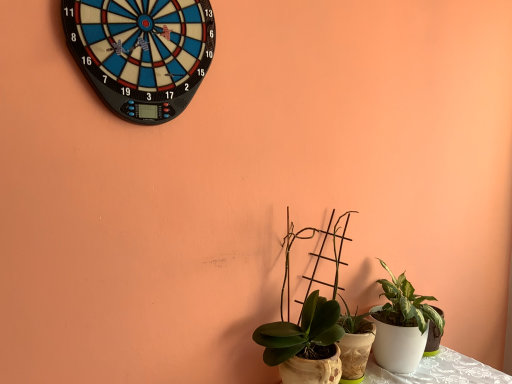
Where is `white glossy pot at lower right, which appears as the 1th houseplant when viewed from the right`? white glossy pot at lower right, which appears as the 1th houseplant when viewed from the right is located at coordinates (402, 325).

Where is `blue plastic dartboard at upper left`? blue plastic dartboard at upper left is located at coordinates [x=141, y=53].

From the picture: Is green matte plant at center, the 1th houseplant from the left, facing away from blue plastic dartboard at upper left?

No.

This screenshot has width=512, height=384. Identify the location of wall clock lying on the left of green matte plant at center, the 1th houseplant from the left. (141, 53).

Is green matte plant at center, which is the second houseplant in right-to-left order, bigger or smaller than blue plastic dartboard at upper left?

In the image, green matte plant at center, which is the second houseplant in right-to-left order, appears to be larger than blue plastic dartboard at upper left.

Looking at this image, which of these two, green matte plant at center, the 1th houseplant from the left, or white glossy pot at lower right, which appears as the 1th houseplant when viewed from the right, is bigger?

green matte plant at center, the 1th houseplant from the left.

Looking at this image, considering the sizes of objects green matte plant at center, which is the second houseplant in right-to-left order, and white glossy pot at lower right, the 2th houseplant in the left-to-right sequence, in the image provided, who is shorter, green matte plant at center, which is the second houseplant in right-to-left order, or white glossy pot at lower right, the 2th houseplant in the left-to-right sequence,?

Standing shorter between the two is white glossy pot at lower right, the 2th houseplant in the left-to-right sequence.

Can you see green matte plant at center, which is the second houseplant in right-to-left order, touching white glossy pot at lower right, the 2th houseplant in the left-to-right sequence?

green matte plant at center, which is the second houseplant in right-to-left order, and white glossy pot at lower right, the 2th houseplant in the left-to-right sequence, are not in contact.

Is point (285, 256) farther from camera compared to point (419, 307)?

No.

Based on the photo, does blue plastic dartboard at upper left appear on the left side of white glossy pot at lower right, the 2th houseplant in the left-to-right sequence?

Yes, blue plastic dartboard at upper left is to the left of white glossy pot at lower right, the 2th houseplant in the left-to-right sequence.

Is blue plastic dartboard at upper left located outside white glossy pot at lower right, the 2th houseplant in the left-to-right sequence?

blue plastic dartboard at upper left is positioned outside white glossy pot at lower right, the 2th houseplant in the left-to-right sequence.

Is blue plastic dartboard at upper left positioned behind white glossy pot at lower right, the 2th houseplant in the left-to-right sequence?

No, the depth of blue plastic dartboard at upper left is less than that of white glossy pot at lower right, the 2th houseplant in the left-to-right sequence.

Does blue plastic dartboard at upper left have a lesser height compared to green matte plant at center, the 1th houseplant from the left?

Correct, blue plastic dartboard at upper left is not as tall as green matte plant at center, the 1th houseplant from the left.

From the image's perspective, would you say blue plastic dartboard at upper left is positioned over green matte plant at center, the 1th houseplant from the left?

Indeed, from the image's perspective, blue plastic dartboard at upper left is shown above green matte plant at center, the 1th houseplant from the left.

Would you say blue plastic dartboard at upper left is outside green matte plant at center, the 1th houseplant from the left?

Yes, blue plastic dartboard at upper left is located beyond the bounds of green matte plant at center, the 1th houseplant from the left.

Measure the distance between blue plastic dartboard at upper left and green matte plant at center, which is the second houseplant in right-to-left order.

They are 30.10 inches apart.

Can you confirm if white glossy pot at lower right, the 2th houseplant in the left-to-right sequence, is taller than blue plastic dartboard at upper left?

Yes, white glossy pot at lower right, the 2th houseplant in the left-to-right sequence, is taller than blue plastic dartboard at upper left.

From the image's perspective, is white glossy pot at lower right, which appears as the 1th houseplant when viewed from the right, above or below blue plastic dartboard at upper left?

white glossy pot at lower right, which appears as the 1th houseplant when viewed from the right, is situated lower than blue plastic dartboard at upper left in the image.

Measure the distance between white glossy pot at lower right, which appears as the 1th houseplant when viewed from the right, and blue plastic dartboard at upper left.

white glossy pot at lower right, which appears as the 1th houseplant when viewed from the right, is 3.74 feet away from blue plastic dartboard at upper left.

Is white glossy pot at lower right, which appears as the 1th houseplant when viewed from the right, next to blue plastic dartboard at upper left and touching it?

white glossy pot at lower right, which appears as the 1th houseplant when viewed from the right, and blue plastic dartboard at upper left are clearly separated.

Measure the distance between white glossy pot at lower right, which appears as the 1th houseplant when viewed from the right, and green matte plant at center, which is the second houseplant in right-to-left order.

The distance of white glossy pot at lower right, which appears as the 1th houseplant when viewed from the right, from green matte plant at center, which is the second houseplant in right-to-left order, is 11.49 inches.

Does white glossy pot at lower right, the 2th houseplant in the left-to-right sequence, contain green matte plant at center, which is the second houseplant in right-to-left order?

Actually, green matte plant at center, which is the second houseplant in right-to-left order, is outside white glossy pot at lower right, the 2th houseplant in the left-to-right sequence.

Looking at this image, from the image's perspective, does white glossy pot at lower right, the 2th houseplant in the left-to-right sequence, appear higher than green matte plant at center, the 1th houseplant from the left?

No, from the image's perspective, white glossy pot at lower right, the 2th houseplant in the left-to-right sequence, is not above green matte plant at center, the 1th houseplant from the left.

From a real-world perspective, is white glossy pot at lower right, the 2th houseplant in the left-to-right sequence, over green matte plant at center, the 1th houseplant from the left?

No, from a real-world perspective, white glossy pot at lower right, the 2th houseplant in the left-to-right sequence, is not on top of green matte plant at center, the 1th houseplant from the left.

From the blue plastic dartboard at upper left, count 1st houseplant to the right and point to it. Please provide its 2D coordinates.

[(307, 324)]

At what (x,y) coordinates should I click in order to perform the action: click on houseplant above the white glossy pot at lower right, which appears as the 1th houseplant when viewed from the right (from the image's perspective). Please return your answer as a coordinate pair (x, y). The height and width of the screenshot is (384, 512). Looking at the image, I should click on (307, 324).

Based on their spatial positions, is blue plastic dartboard at upper left or green matte plant at center, the 1th houseplant from the left, closer to white glossy pot at lower right, the 2th houseplant in the left-to-right sequence?

green matte plant at center, the 1th houseplant from the left.

Which object lies nearer to the anchor point green matte plant at center, which is the second houseplant in right-to-left order, white glossy pot at lower right, the 2th houseplant in the left-to-right sequence, or blue plastic dartboard at upper left?

white glossy pot at lower right, the 2th houseplant in the left-to-right sequence, is positioned closer to the anchor green matte plant at center, which is the second houseplant in right-to-left order.

Based on their spatial positions, is green matte plant at center, which is the second houseplant in right-to-left order, or white glossy pot at lower right, the 2th houseplant in the left-to-right sequence, further from blue plastic dartboard at upper left?

white glossy pot at lower right, the 2th houseplant in the left-to-right sequence, lies further to blue plastic dartboard at upper left than the other object.

Looking at the image, which one is located further to blue plastic dartboard at upper left, white glossy pot at lower right, which appears as the 1th houseplant when viewed from the right, or green matte plant at center, the 1th houseplant from the left?

white glossy pot at lower right, which appears as the 1th houseplant when viewed from the right.

Which object lies further to the anchor point green matte plant at center, the 1th houseplant from the left, blue plastic dartboard at upper left or white glossy pot at lower right, which appears as the 1th houseplant when viewed from the right?

The object further to green matte plant at center, the 1th houseplant from the left, is blue plastic dartboard at upper left.

Which object lies further to the anchor point white glossy pot at lower right, which appears as the 1th houseplant when viewed from the right, green matte plant at center, which is the second houseplant in right-to-left order, or blue plastic dartboard at upper left?

The object further to white glossy pot at lower right, which appears as the 1th houseplant when viewed from the right, is blue plastic dartboard at upper left.

I want to click on houseplant between blue plastic dartboard at upper left and white glossy pot at lower right, which appears as the 1th houseplant when viewed from the right, in the up-down direction, so click(x=307, y=324).